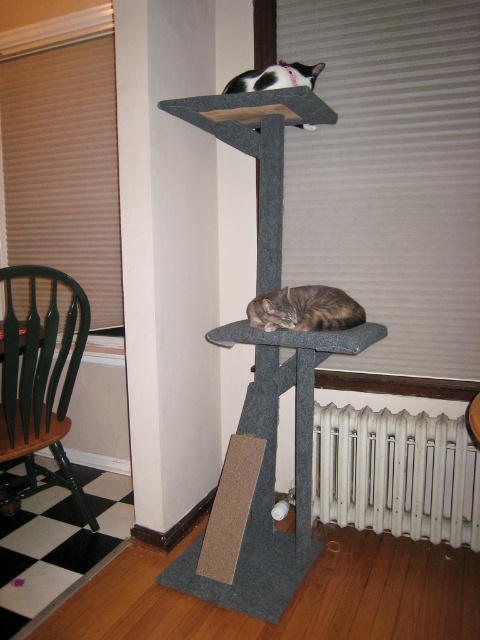
Is point (24, 429) positioned in front of point (361, 307)?

Yes, it is.

Find the location of a particular element. green wood chair at left is located at coordinates (39, 385).

Which is behind, point (430, 452) or point (312, 324)?

The point (430, 452) is more distant.

Between white metal radiator at lower center and brown fur cat at lower center, which one is positioned lower?

white metal radiator at lower center

I want to click on white metal radiator at lower center, so click(396, 474).

Between brown fur cat at lower center and black-and-white fur cat at upper center, which one has less height?

Standing shorter between the two is brown fur cat at lower center.

Does point (267, 317) come farther from viewer compared to point (267, 74)?

No, (267, 317) is closer to viewer.

Find the location of a particular element. brown fur cat at lower center is located at coordinates (304, 308).